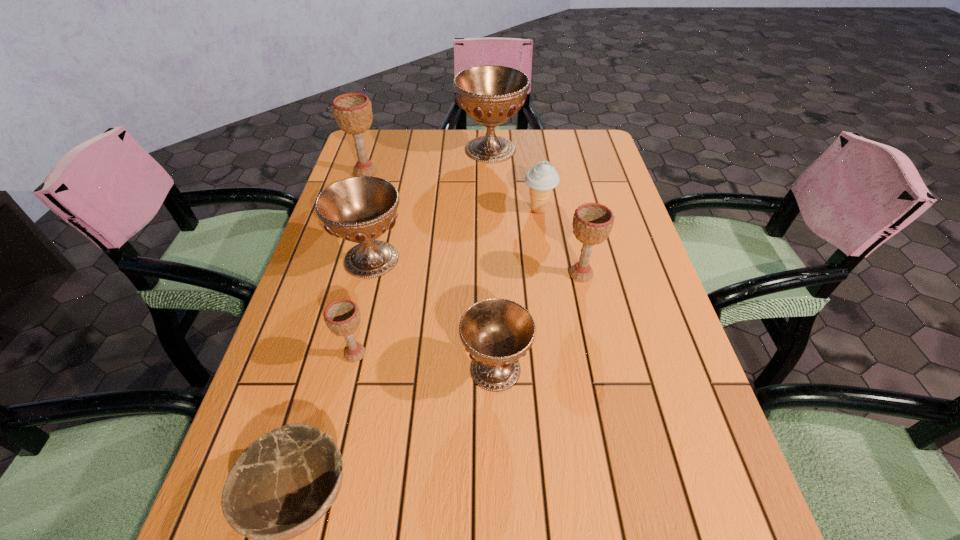
What are the coordinates of `object that is at the far left corner` in the screenshot? It's located at (353, 111).

This screenshot has width=960, height=540. Identify the location of free space at the far edge of the desktop. (434, 137).

Where is `vacant area at the left edge of the desktop`? Image resolution: width=960 pixels, height=540 pixels. vacant area at the left edge of the desktop is located at coordinates (357, 342).

In the image, there is a desktop. At what (x,y) coordinates should I click in order to perform the action: click on blank space at the right edge. Please return your answer as a coordinate pair (x, y). The width and height of the screenshot is (960, 540). Looking at the image, I should click on (724, 480).

Find the location of a particular element. The image size is (960, 540). free space at the far right corner of the desktop is located at coordinates (601, 143).

The width and height of the screenshot is (960, 540). I want to click on vacant point located between the farthest beige chalice and the nearest red chalice, so (x=430, y=271).

Locate an element on the screen. free space between the farthest red chalice and the leftmost beige chalice is located at coordinates (428, 161).

Locate an element on the screen. This screenshot has height=540, width=960. empty space that is in between the biggest red chalice and the third farthest object is located at coordinates (515, 180).

Locate an element on the screen. The width and height of the screenshot is (960, 540). vacant area that lies between the icecream and the leftmost beige chalice is located at coordinates (452, 191).

Locate an element on the screen. This screenshot has width=960, height=540. vacant point located between the nearest red chalice and the second biggest red chalice is located at coordinates (433, 314).